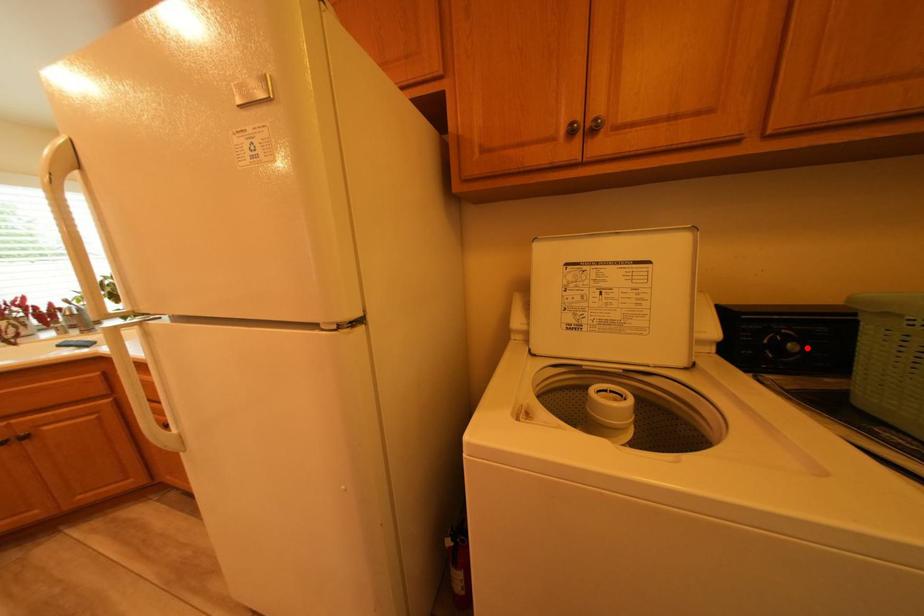
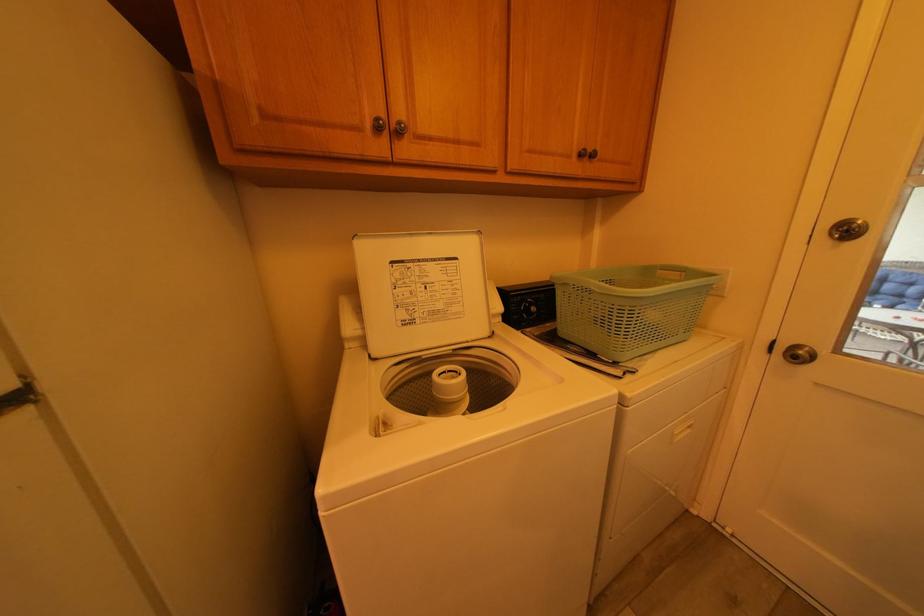
Where in the second image is the point corresponding to the highlighted location from the first image?

(548, 310)